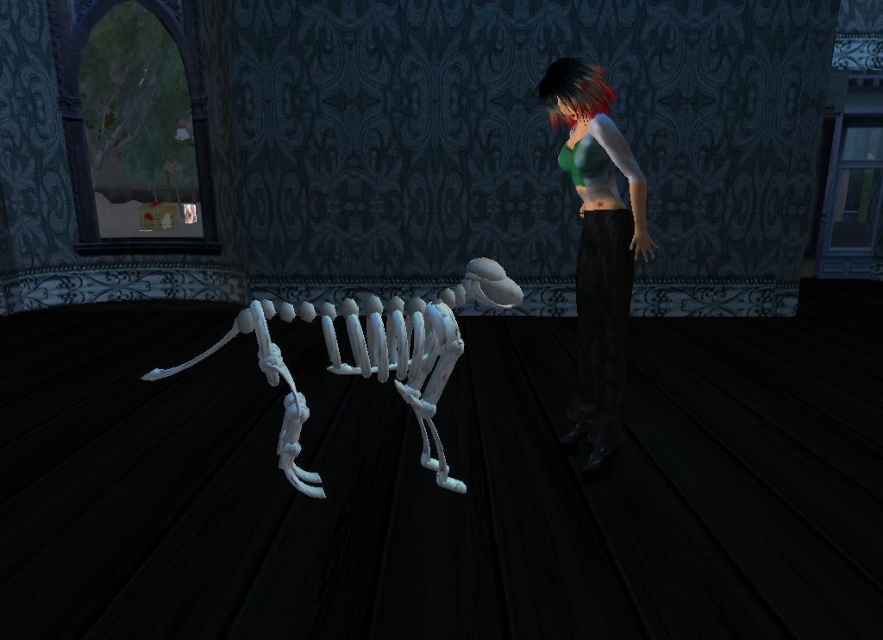
Who is shorter, green matte shirt at center or white matte skeleton at center?

Standing shorter between the two is white matte skeleton at center.

Can you confirm if green matte shirt at center is positioned to the right of white matte skeleton at center?

Indeed, green matte shirt at center is positioned on the right side of white matte skeleton at center.

Describe the element at coordinates (597, 244) in the screenshot. I see `green matte shirt at center` at that location.

This screenshot has width=883, height=640. What are the coordinates of `green matte shirt at center` in the screenshot? It's located at (597, 244).

Who is more distant from viewer, (x=340, y=312) or (x=562, y=118)?

Positioned behind is point (x=562, y=118).

Can you confirm if white matte skeleton at center is smaller than shiny dark hair at upper center?

No, white matte skeleton at center is not smaller than shiny dark hair at upper center.

Is point (323, 316) more distant than point (572, 60)?

That is False.

This screenshot has width=883, height=640. Find the location of `white matte skeleton at center`. white matte skeleton at center is located at coordinates [372, 355].

From the picture: Can you confirm if green matte shirt at center is smaller than shiny dark hair at upper center?

No, green matte shirt at center is not smaller than shiny dark hair at upper center.

Between green matte shirt at center and shiny dark hair at upper center, which one appears on the left side from the viewer's perspective?

shiny dark hair at upper center

I want to click on green matte shirt at center, so click(597, 244).